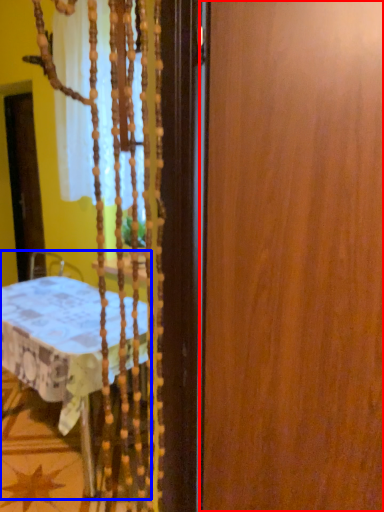
Question: Which object appears closest to the camera in this image, barn door (highlighted by a red box) or furniture (highlighted by a blue box)?

Choices:
 (A) barn door
 (B) furniture

Answer: (A)